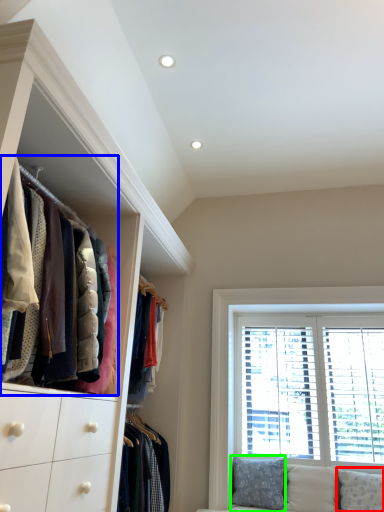
Question: Which object is the farthest from pillow (highlighted by a red box)? Choose among these: closet (highlighted by a blue box) or pillow (highlighted by a green box).

Choices:
 (A) closet
 (B) pillow

Answer: (A)